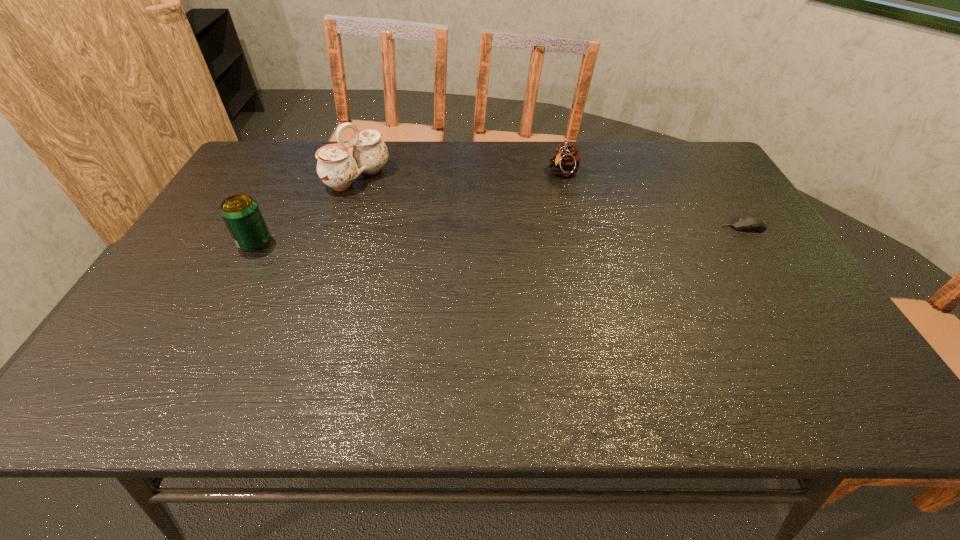
The width and height of the screenshot is (960, 540). In order to click on blank region between the pinecone and the computer mouse in this screenshot , I will do `click(654, 200)`.

I want to click on free space between the tallest object and the computer mouse, so click(550, 202).

The image size is (960, 540). Find the location of `free space between the beer can and the chinaware`. free space between the beer can and the chinaware is located at coordinates (306, 210).

Identify the location of vacant space that's between the second object from left to right and the computer mouse. The height and width of the screenshot is (540, 960). (550, 202).

In order to click on vacant space that is in between the second object from right to left and the shortest object in this screenshot , I will do `click(654, 200)`.

Locate an element on the screen. The height and width of the screenshot is (540, 960). object that is the closest to the leftmost object is located at coordinates (339, 164).

Locate an element on the screen. This screenshot has width=960, height=540. object that ranks as the closest to the shortest object is located at coordinates (565, 160).

Locate an element on the screen. vacant space that satisfies the following two spatial constraints: 1. on the back side of the third shortest object; 2. on the right side of the pinecone is located at coordinates (292, 173).

I want to click on free space in the image that satisfies the following two spatial constraints: 1. on the front side of the computer mouse; 2. on the right side of the third object from right to left, so click(x=341, y=227).

I want to click on free space that satisfies the following two spatial constraints: 1. on the front side of the rightmost object; 2. on the left side of the tallest object, so click(x=341, y=227).